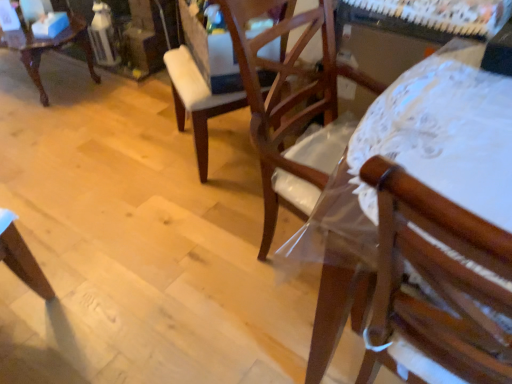
This screenshot has width=512, height=384. I want to click on vacant space in front of wooden chair at center, arranged as the second chair when viewed from the left, so click(x=208, y=204).